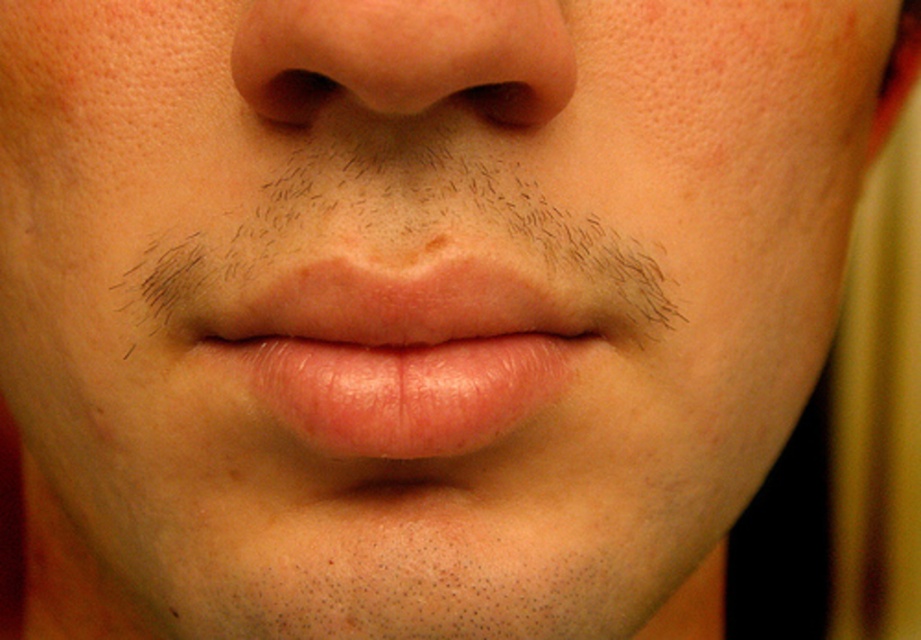
Question: Which is nearer to the black matte eye at upper center?

Choices:
 (A) pink smooth lips at center
 (B) smooth skin nose at center
 (C) brown hair at center

Answer: (B)

Question: Estimate the real-world distances between objects in this image. Which object is farther from the smooth skin nose at center?

Choices:
 (A) pink smooth lips at center
 (B) brown hair at center
 (C) black matte eye at upper center

Answer: (A)

Question: Which point is closer to the camera taking this photo?

Choices:
 (A) (296, 330)
 (B) (493, 115)

Answer: (B)

Question: In this image, where is smooth skin nose at center located relative to black matte eye at upper center?

Choices:
 (A) right
 (B) left

Answer: (B)

Question: Is brown hair at center to the right of smooth skin nose at center from the viewer's perspective?

Choices:
 (A) no
 (B) yes

Answer: (A)

Question: Does brown hair at center have a lesser width compared to smooth skin nose at center?

Choices:
 (A) no
 (B) yes

Answer: (A)